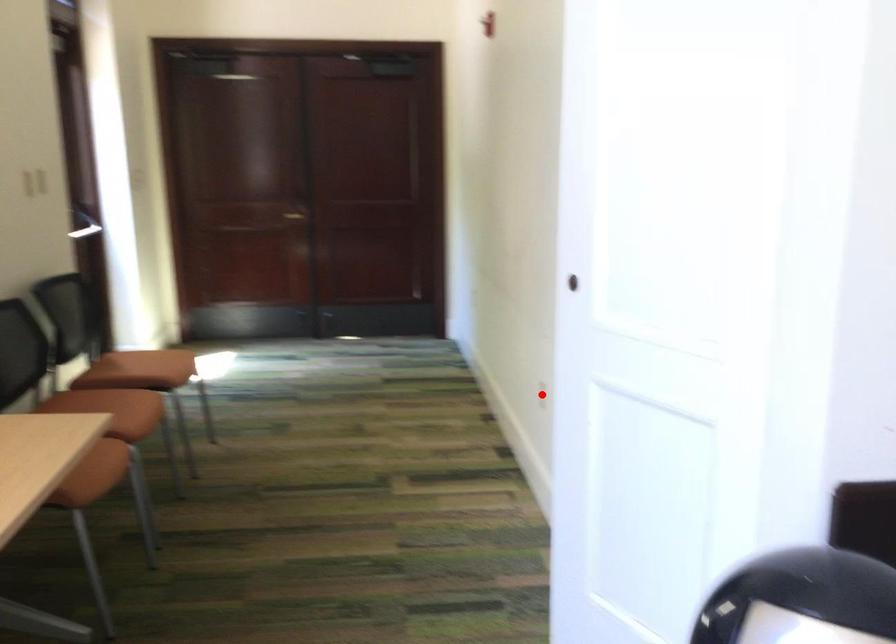
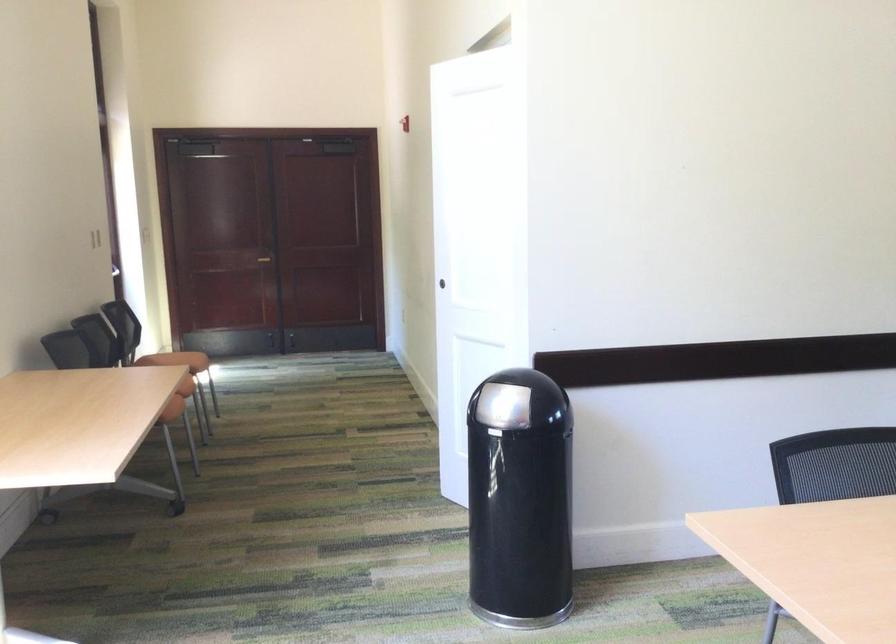
Question: I am providing you with two images of the same scene from different viewpoints. A red point is marked on the first image. At the location where the point appears in image 1, is it still visible in image 2?

Choices:
 (A) Yes
 (B) No

Answer: (B)